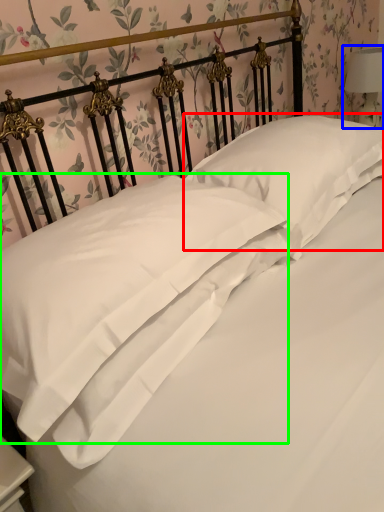
Question: Which is nearer to the pillow (highlighted by a red box)? bedside lamp (highlighted by a blue box) or pillow (highlighted by a green box).

Choices:
 (A) bedside lamp
 (B) pillow

Answer: (B)